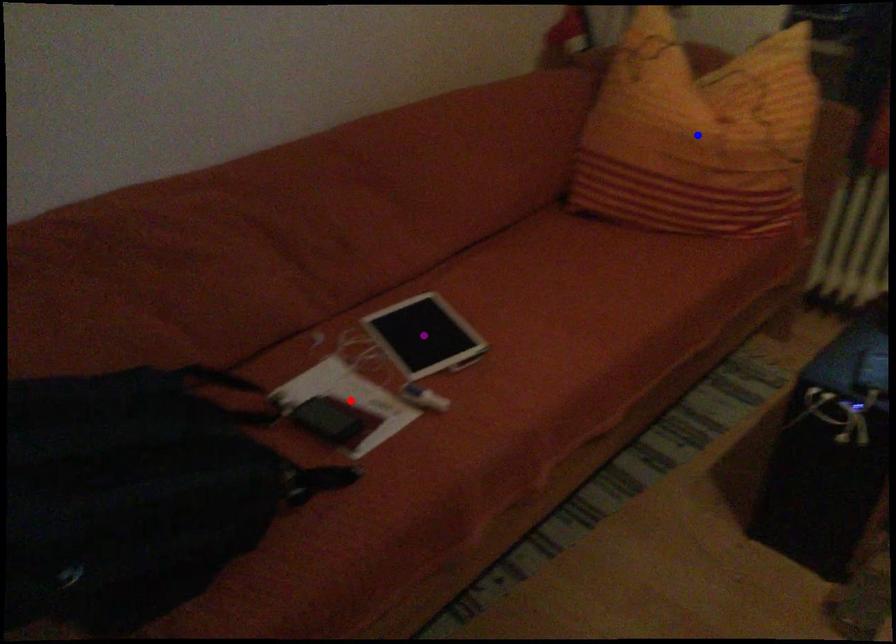
Order these from nearest to farthest:
purple point, blue point, red point

red point
blue point
purple point